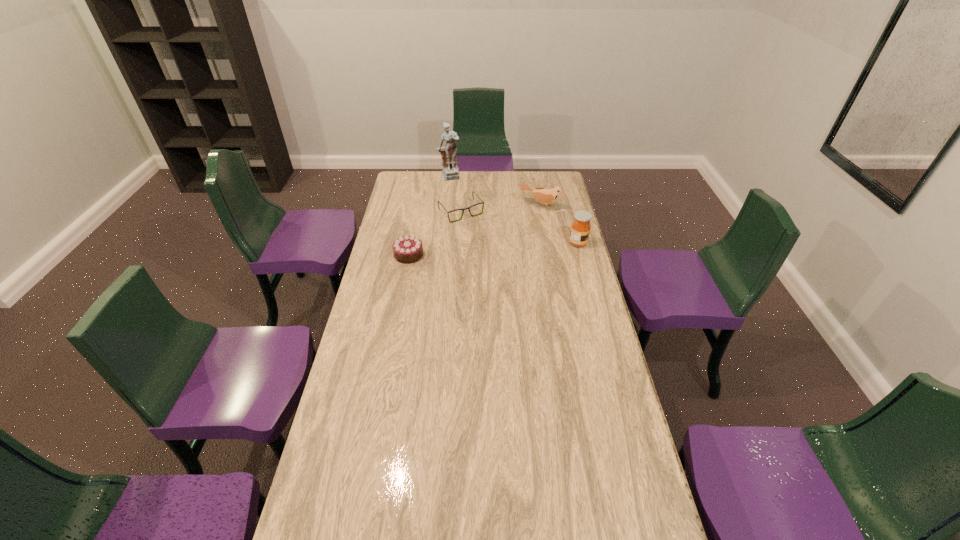
Find the location of a particular element. vacant space on the desktop that is between the chocolate cake and the fourth shortest object and is positioned at the beak of the third tallest object is located at coordinates (517, 247).

The width and height of the screenshot is (960, 540). I want to click on vacant spot on the desktop that is between the chocolate cake and the honey and is positioned on the lens of the shortest object, so click(492, 249).

The image size is (960, 540). I want to click on vacant space on the desktop that is between the second shortest object and the honey and is positioned on the front-facing side of the tallest object, so click(492, 249).